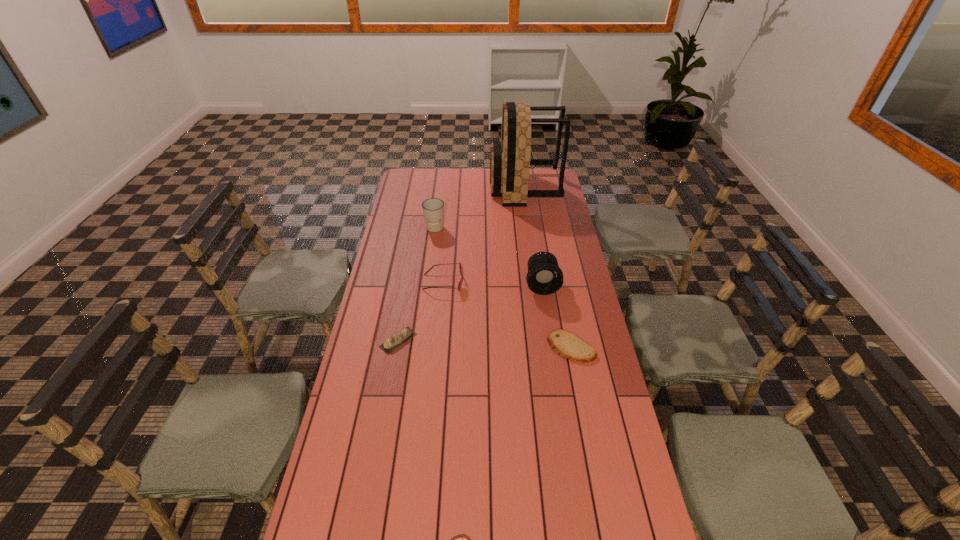
I want to click on vacant area situated 0.150m at the front element of the telephoto lens, so click(548, 325).

Image resolution: width=960 pixels, height=540 pixels. What are the coordinates of `vacant area situated 0.290m with a handle on the side of the second farthest object` in the screenshot? It's located at (428, 279).

Where is `vacant area located on the front-facing side of the sunglasses`? Image resolution: width=960 pixels, height=540 pixels. vacant area located on the front-facing side of the sunglasses is located at coordinates (535, 282).

Image resolution: width=960 pixels, height=540 pixels. What are the coordinates of `vacant space situated 0.370m on the right of the leftmost pita bread` in the screenshot? It's located at (520, 340).

This screenshot has height=540, width=960. Identify the location of free region located on the back of the rightmost pita bread. (564, 310).

Image resolution: width=960 pixels, height=540 pixels. Identify the location of object present at the far edge. (510, 161).

This screenshot has width=960, height=540. I want to click on cup present at the left edge, so click(433, 209).

This screenshot has height=540, width=960. I want to click on pita bread that is at the left edge, so click(396, 340).

The image size is (960, 540). Find the location of `backpack present at the right edge`. backpack present at the right edge is located at coordinates click(x=510, y=161).

Where is `telephoto lens present at the right edge`? telephoto lens present at the right edge is located at coordinates (544, 277).